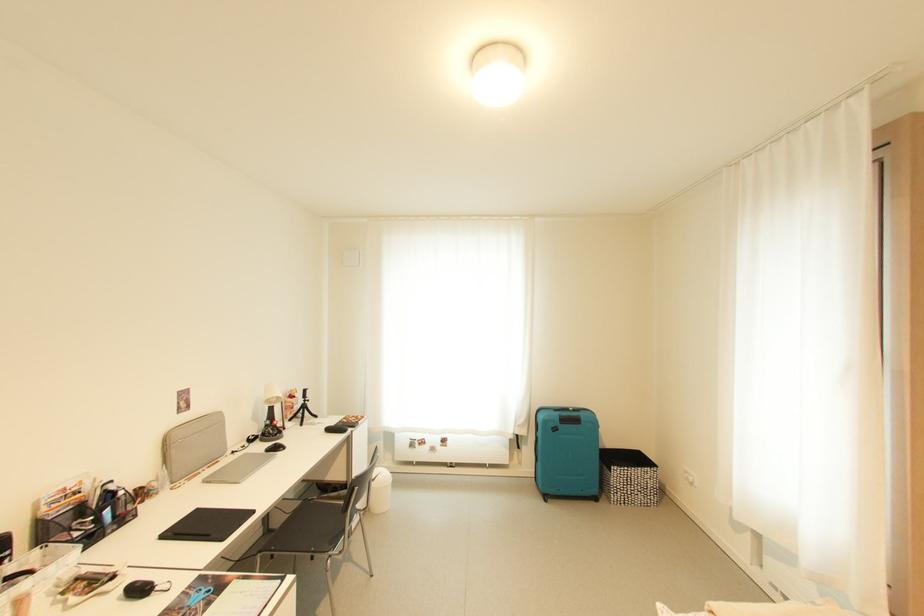
Where would you sit the chair sitting surface? Please return your answer as a coordinate pair (x, y).

(305, 533)